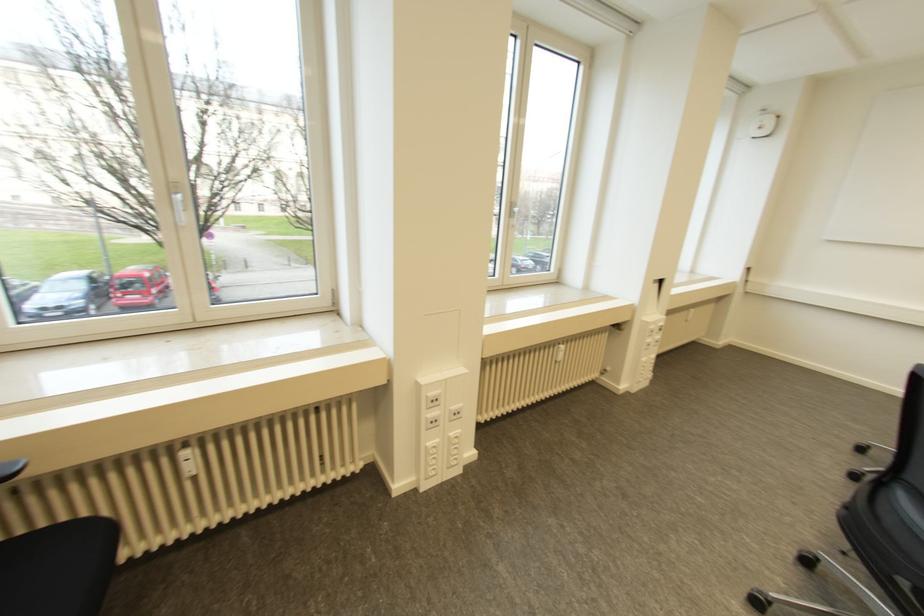
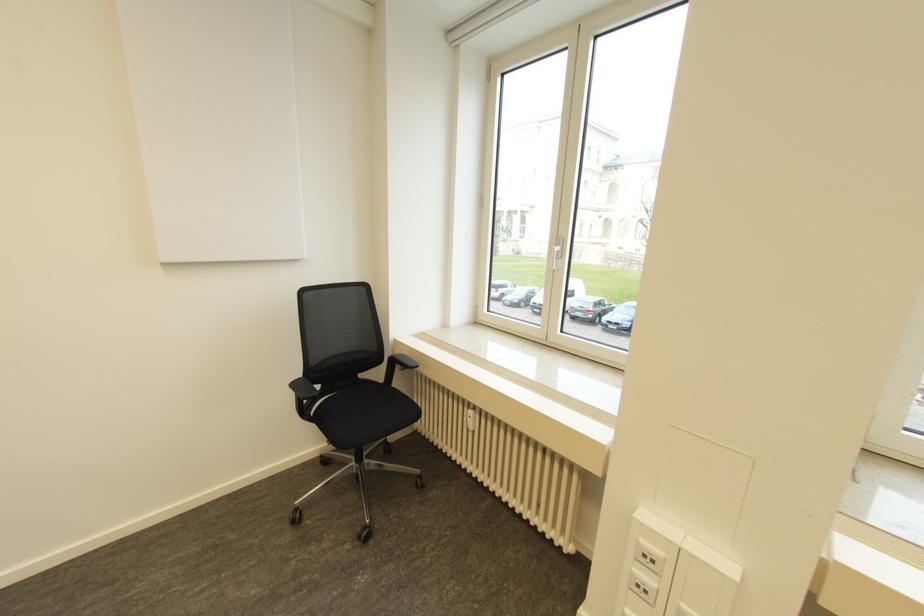
Question: The camera is either moving clockwise (left) or counter-clockwise (right) around the object. The first image is from the beginning of the video and the second image is from the end. Is the camera moving left or right when shooting the video?

Choices:
 (A) Left
 (B) Right

Answer: (B)